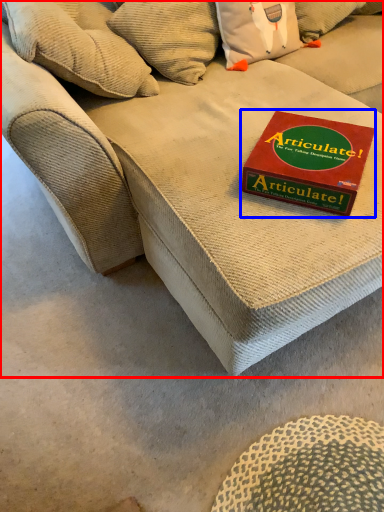
Question: Which object appears closest to the camera in this image, studio couch (highlighted by a red box) or paperback book (highlighted by a blue box)?

Choices:
 (A) studio couch
 (B) paperback book

Answer: (A)